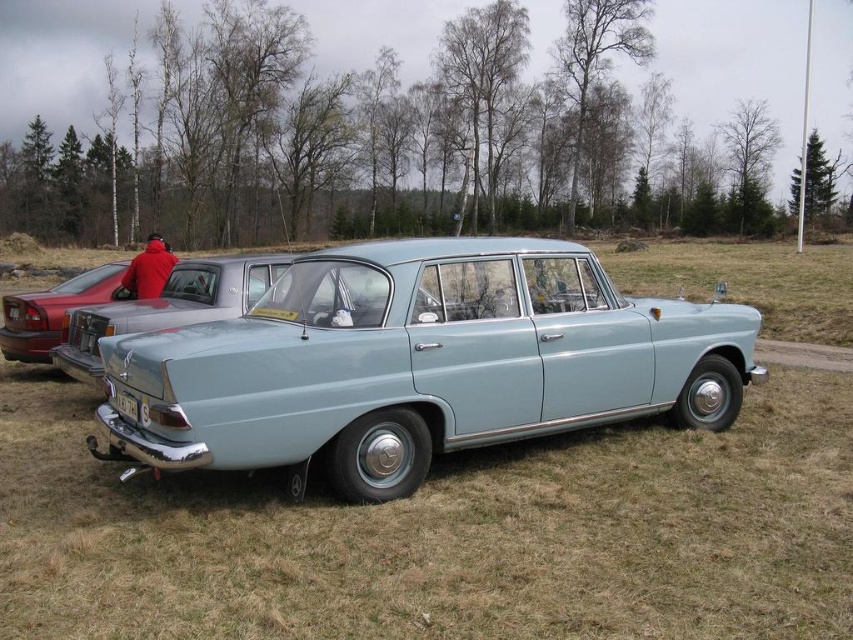
Question: Is light blue metallic car at center closer to camera compared to matte black car at left?

Choices:
 (A) yes
 (B) no

Answer: (A)

Question: Is matte black car at left to the left of red fabric jacket at rear from the viewer's perspective?

Choices:
 (A) yes
 (B) no

Answer: (B)

Question: Is light blue matte sedan at center bigger than red fabric jacket at rear?

Choices:
 (A) yes
 (B) no

Answer: (B)

Question: Considering the real-world distances, which object is closest to the red fabric jacket at rear?

Choices:
 (A) light blue matte sedan at center
 (B) light blue metallic car at center
 (C) matte black car at left

Answer: (A)

Question: Which of the following is the farthest from the observer?

Choices:
 (A) red fabric jacket at rear
 (B) light blue metallic car at center
 (C) light blue matte sedan at center

Answer: (A)

Question: Which of the following is the closest to the observer?

Choices:
 (A) (225, 300)
 (B) (80, 291)
 (C) (207, 397)
 (D) (161, 250)

Answer: (C)